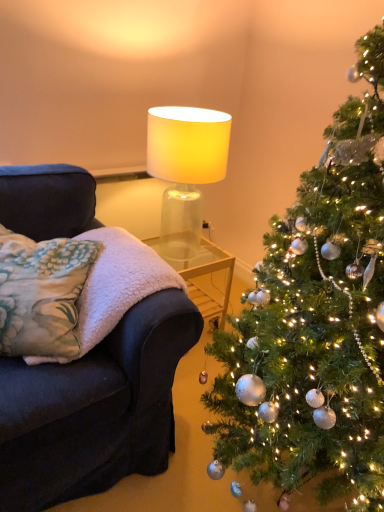
Question: Does fluffy white blanket at left appear on the left side of translucent glass lampshade at upper center?

Choices:
 (A) no
 (B) yes

Answer: (B)

Question: Is fluffy white blanket at left beside translucent glass lampshade at upper center?

Choices:
 (A) no
 (B) yes

Answer: (A)

Question: From a real-world perspective, does fluffy white blanket at left sit lower than translucent glass lampshade at upper center?

Choices:
 (A) yes
 (B) no

Answer: (A)

Question: From the image's perspective, is fluffy white blanket at left above translucent glass lampshade at upper center?

Choices:
 (A) no
 (B) yes

Answer: (A)

Question: From a real-world perspective, is fluffy white blanket at left on top of translucent glass lampshade at upper center?

Choices:
 (A) yes
 (B) no

Answer: (B)

Question: From the image's perspective, is fluffy white blanket at left under translucent glass lampshade at upper center?

Choices:
 (A) yes
 (B) no

Answer: (A)

Question: Is translucent glass lampshade at upper center taller than fluffy floral pillow at left?

Choices:
 (A) no
 (B) yes

Answer: (B)

Question: Can you confirm if translucent glass lampshade at upper center is thinner than fluffy floral pillow at left?

Choices:
 (A) no
 (B) yes

Answer: (B)

Question: Can we say translucent glass lampshade at upper center lies outside fluffy floral pillow at left?

Choices:
 (A) no
 (B) yes

Answer: (B)

Question: Is translucent glass lampshade at upper center wider than fluffy floral pillow at left?

Choices:
 (A) no
 (B) yes

Answer: (A)

Question: Does translucent glass lampshade at upper center turn towards fluffy floral pillow at left?

Choices:
 (A) no
 (B) yes

Answer: (B)

Question: Is translucent glass lampshade at upper center facing away from fluffy floral pillow at left?

Choices:
 (A) yes
 (B) no

Answer: (B)

Question: Are fluffy floral pillow at left and shiny silver ornaments at right far apart?

Choices:
 (A) no
 (B) yes

Answer: (A)